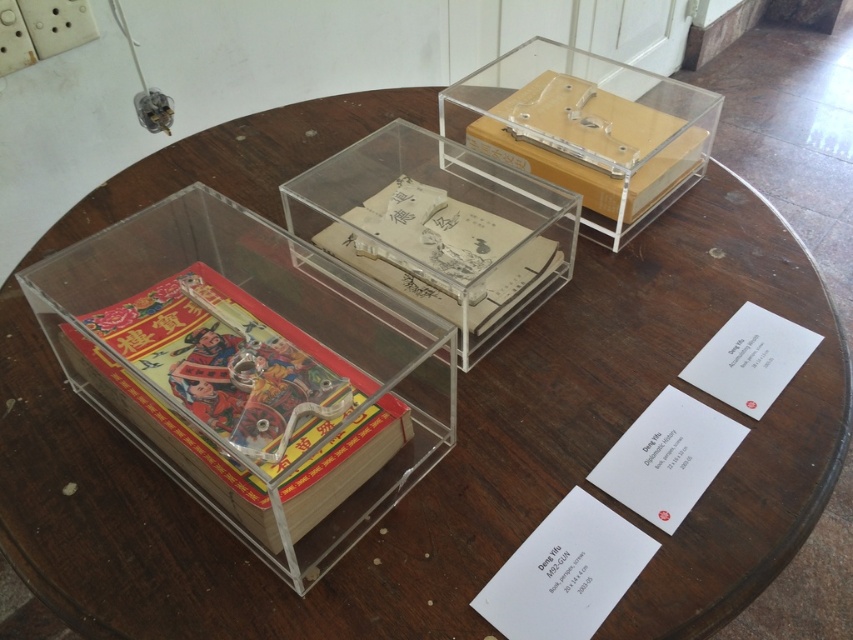
You are a visitor at an exhibition and see the red glossy book at center and the transparent acrylic box at upper center. Which object is positioned higher from the ground?

The transparent acrylic box at upper center is positioned higher from the ground than the red glossy book at center because the red glossy book at center is below it.

You are a visitor at an exhibition and see the transparent acrylic box at upper center and the yellowish paper book at center. Which object is positioned higher from the ground?

The transparent acrylic box at upper center is positioned higher from the ground than the yellowish paper book at center.